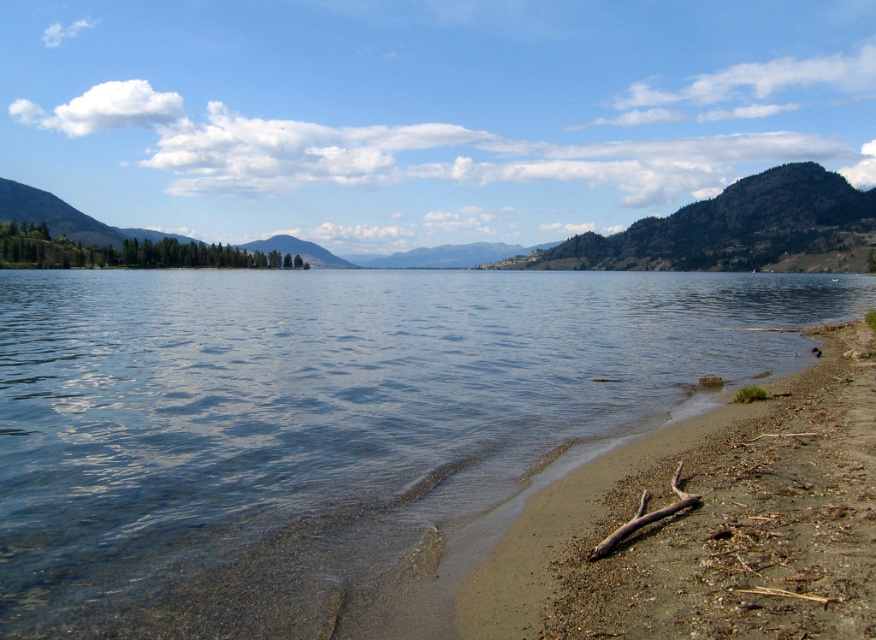
The image size is (876, 640). Describe the element at coordinates (323, 420) in the screenshot. I see `clear water at shore left` at that location.

Who is more distant from viewer, [20,474] or [788,579]?

Positioned behind is point [20,474].

The image size is (876, 640). In order to click on clear water at shore left in this screenshot , I will do `click(323, 420)`.